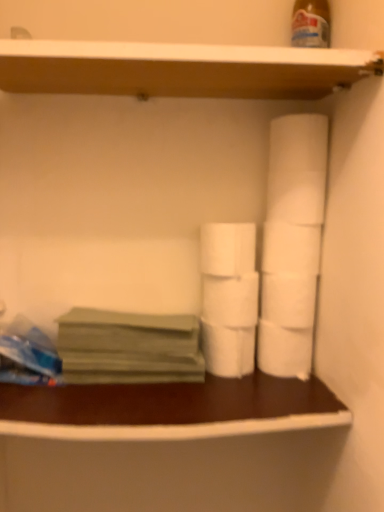
Locate an element on the screen. vacant space underneath wooden at upper center (from a real-world perspective) is located at coordinates (170, 392).